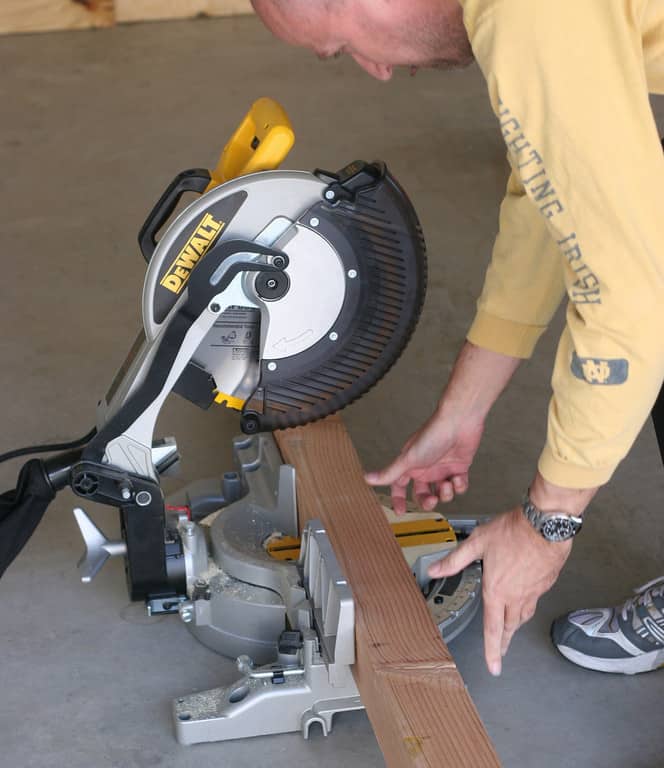
This screenshot has width=664, height=768. Find the location of `floor`. floor is located at coordinates pyautogui.click(x=76, y=660).